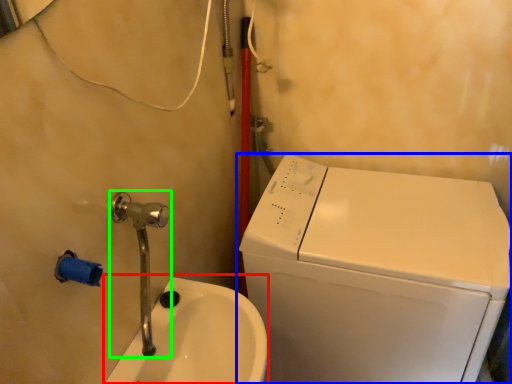
Question: Which object is positioned farthest from sink (highlighted by a red box)? Select from washing machine (highlighted by a blue box) and plumbing fixture (highlighted by a green box).

Choices:
 (A) washing machine
 (B) plumbing fixture

Answer: (A)